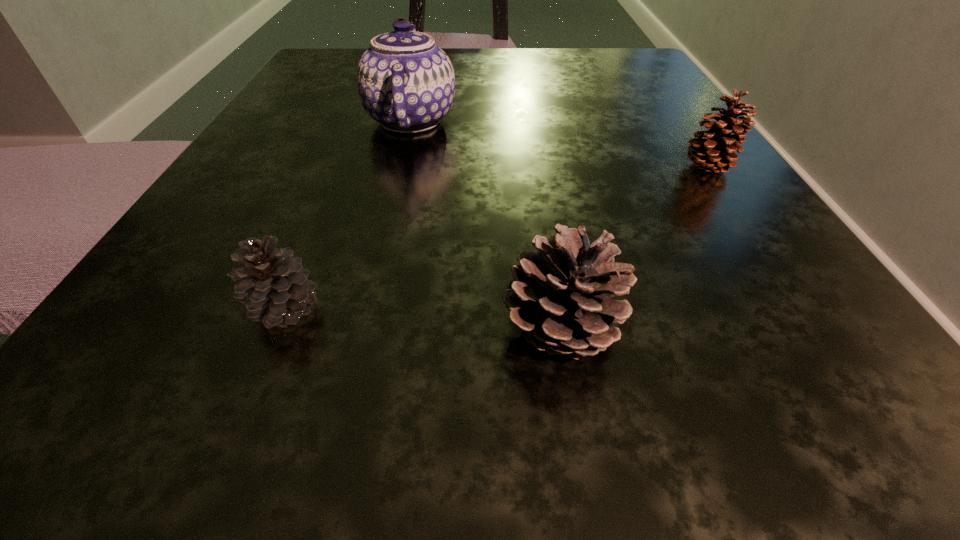
Identify the location of the tallest object. (406, 83).

I want to click on the third object from left to right, so click(561, 296).

Where is `the farthest pinecone`? This screenshot has width=960, height=540. the farthest pinecone is located at coordinates (717, 153).

Identify the location of the rightmost object. (717, 153).

Where is `the shortest object`? The width and height of the screenshot is (960, 540). the shortest object is located at coordinates (274, 287).

Image resolution: width=960 pixels, height=540 pixels. I want to click on the leftmost pinecone, so click(x=274, y=287).

What are the coordinates of `free space located 0.340m at the spout of the chinaware` in the screenshot? It's located at (682, 121).

You are a GUI agent. You are given a task and a screenshot of the screen. Output one action in this format:
    pyautogui.click(x=<x>, y=<y>)
    Task: Click on the vacant space situated on the back of the second pinecone from left to right
    This screenshot has height=540, width=960.
    Given the screenshot: What is the action you would take?
    pyautogui.click(x=545, y=240)

Where is `vacant region located on the back of the rightmost pinecone`? This screenshot has width=960, height=540. vacant region located on the back of the rightmost pinecone is located at coordinates (633, 60).

Find the location of a particular element. This screenshot has height=540, width=960. free space located on the back of the shortest object is located at coordinates [344, 168].